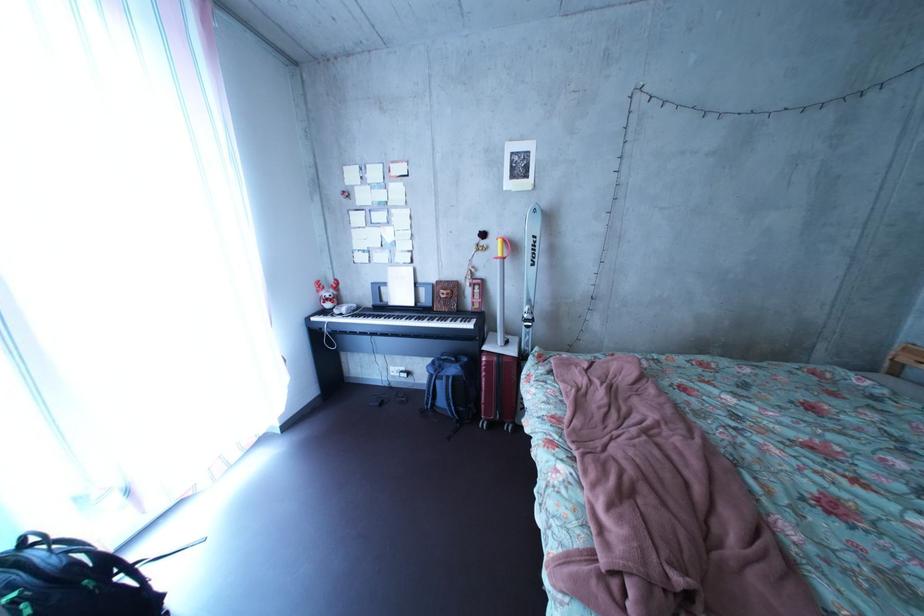
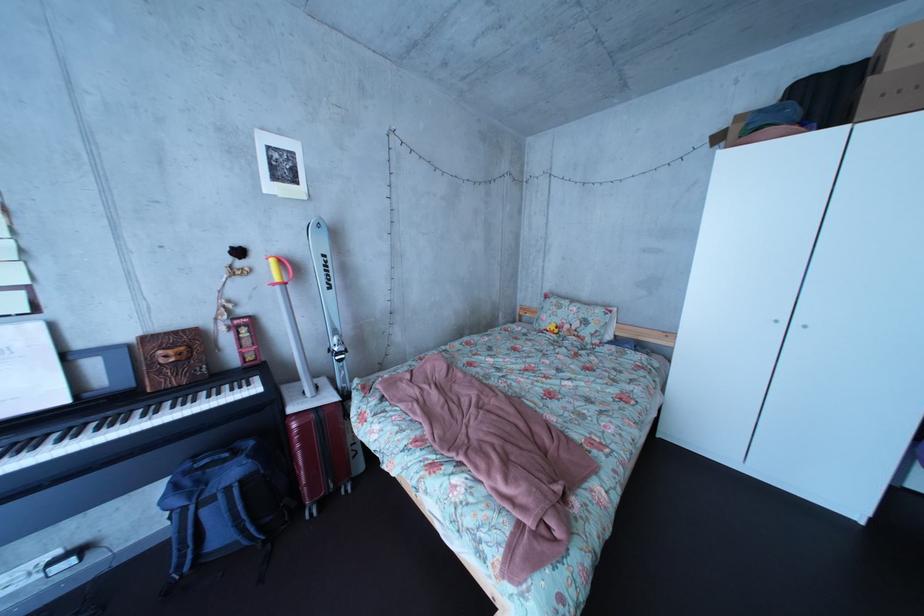
Question: The camera is either moving clockwise (left) or counter-clockwise (right) around the object. The first image is from the beginning of the video and the second image is from the end. Is the camera moving left or right when shooting the video?

Choices:
 (A) Left
 (B) Right

Answer: (A)